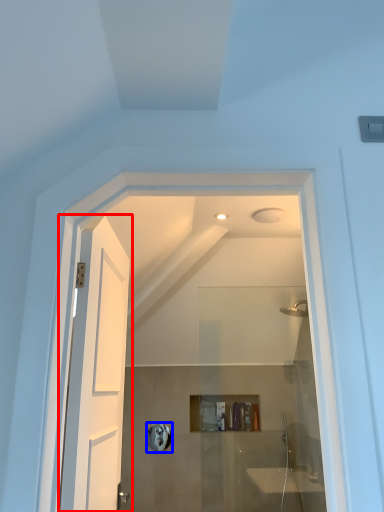
Question: Which object is further to the camera taking this photo, door (highlighted by a red box) or towel bar (highlighted by a blue box)?

Choices:
 (A) door
 (B) towel bar

Answer: (B)